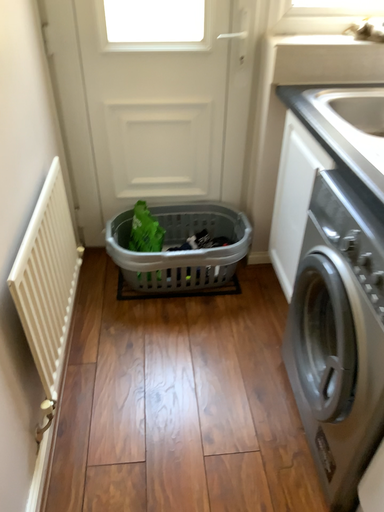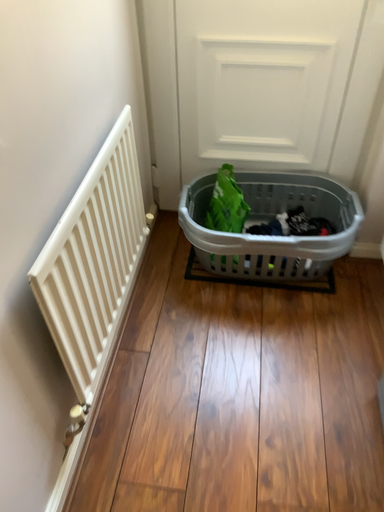
Question: How did the camera likely rotate when shooting the video?

Choices:
 (A) rotated left
 (B) rotated right

Answer: (A)